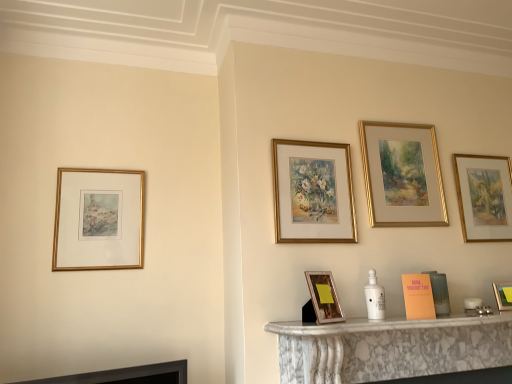
Question: Is gold/gilded frame at center, marked as the 3th picture frame in a left-to-right arrangement, positioned before matte gold picture frame at right, acting as the fifth picture frame starting from the left?

Choices:
 (A) yes
 (B) no

Answer: (A)

Question: From a real-world perspective, is gold/gilded frame at center, marked as the 3th picture frame in a left-to-right arrangement, located beneath matte gold picture frame at right, positioned as the 2th picture frame in right-to-left order?

Choices:
 (A) no
 (B) yes

Answer: (A)

Question: Can you confirm if gold/gilded frame at center, the fourth picture frame in the right-to-left sequence, is positioned to the left of matte gold picture frame at right, acting as the fifth picture frame starting from the left?

Choices:
 (A) yes
 (B) no

Answer: (A)

Question: Is gold/gilded frame at center, the fourth picture frame in the right-to-left sequence, further to the viewer compared to matte gold picture frame at right, positioned as the 2th picture frame in right-to-left order?

Choices:
 (A) no
 (B) yes

Answer: (A)

Question: Can you confirm if gold/gilded frame at center, marked as the 3th picture frame in a left-to-right arrangement, is smaller than matte gold picture frame at right, acting as the fifth picture frame starting from the left?

Choices:
 (A) yes
 (B) no

Answer: (B)

Question: From their relative heights in the image, would you say gold-framed painting at upper center, placed as the 3th picture frame when sorted from right to left, is taller or shorter than gold/gilded frame at center, the fourth picture frame in the right-to-left sequence?

Choices:
 (A) tall
 (B) short

Answer: (A)

Question: Based on their positions, is gold-framed painting at upper center, placed as the 3th picture frame when sorted from right to left, located to the left or right of gold/gilded frame at center, the fourth picture frame in the right-to-left sequence?

Choices:
 (A) right
 (B) left

Answer: (A)

Question: Considering the positions of gold-framed painting at upper center, placed as the 3th picture frame when sorted from right to left, and gold/gilded frame at center, marked as the 3th picture frame in a left-to-right arrangement, in the image, is gold-framed painting at upper center, placed as the 3th picture frame when sorted from right to left, bigger or smaller than gold/gilded frame at center, marked as the 3th picture frame in a left-to-right arrangement,?

Choices:
 (A) big
 (B) small

Answer: (B)

Question: Considering the positions of gold-framed painting at upper center, placed as the 3th picture frame when sorted from right to left, and gold/gilded frame at center, the fourth picture frame in the right-to-left sequence, in the image, is gold-framed painting at upper center, placed as the 3th picture frame when sorted from right to left, wider or thinner than gold/gilded frame at center, the fourth picture frame in the right-to-left sequence,?

Choices:
 (A) thin
 (B) wide

Answer: (A)

Question: Is point (419, 286) closer or farther from the camera than point (490, 158)?

Choices:
 (A) closer
 (B) farther

Answer: (A)

Question: Is orange matte book at lower right wider or thinner than gold-framed painting at upper right, which appears as the first picture frame when viewed from the right?

Choices:
 (A) wide
 (B) thin

Answer: (A)

Question: Is orange matte book at lower right bigger or smaller than gold-framed painting at upper right, the sixth picture frame when ordered from left to right?

Choices:
 (A) small
 (B) big

Answer: (A)

Question: Is orange matte book at lower right to the left or to the right of gold-framed painting at upper right, the sixth picture frame when ordered from left to right, in the image?

Choices:
 (A) left
 (B) right

Answer: (A)

Question: Does point (53, 261) appear closer or farther from the camera than point (426, 302)?

Choices:
 (A) farther
 (B) closer

Answer: (A)

Question: In terms of width, does gold framed print at left, positioned as the first picture frame in left-to-right order, look wider or thinner when compared to orange matte book at lower right?

Choices:
 (A) wide
 (B) thin

Answer: (B)